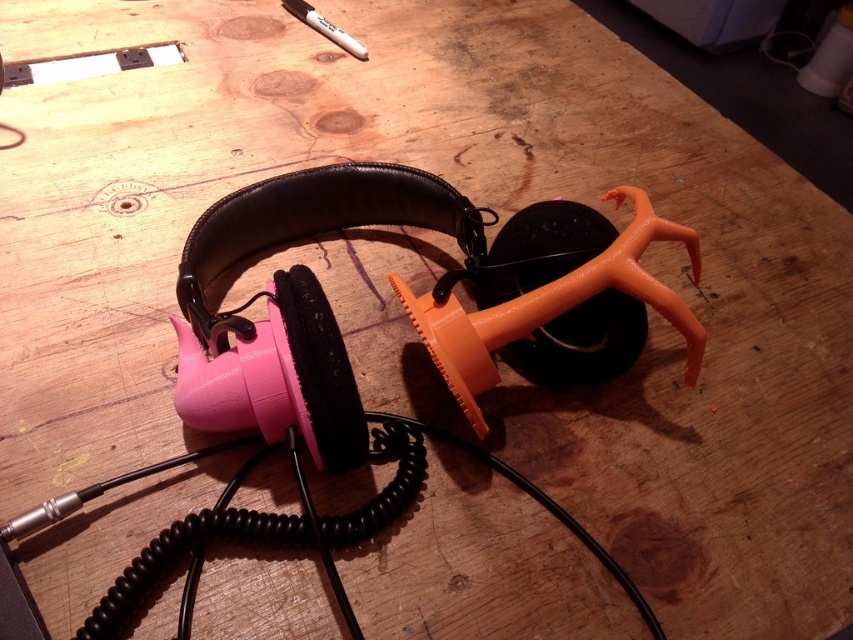
Question: Can you confirm if pink matte/soft earphone at center-left is positioned to the right of white matte marker at upper center?

Choices:
 (A) yes
 (B) no

Answer: (A)

Question: Can you confirm if pink matte/soft earphone at center-left is positioned to the left of white matte marker at upper center?

Choices:
 (A) yes
 (B) no

Answer: (B)

Question: Considering the relative positions of pink matte/soft earphone at center-left and white matte marker at upper center in the image provided, where is pink matte/soft earphone at center-left located with respect to white matte marker at upper center?

Choices:
 (A) left
 (B) right

Answer: (B)

Question: Among these objects, which one is nearest to the camera?

Choices:
 (A) pink matte/soft earphone at center-left
 (B) white matte marker at upper center

Answer: (A)